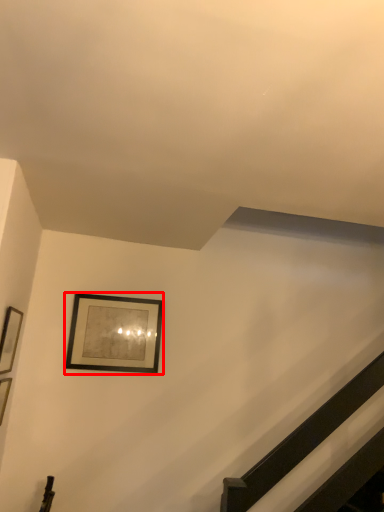
Question: Where is picture frame (annotated by the red box) located in relation to picture frame in the image?

Choices:
 (A) left
 (B) right

Answer: (B)